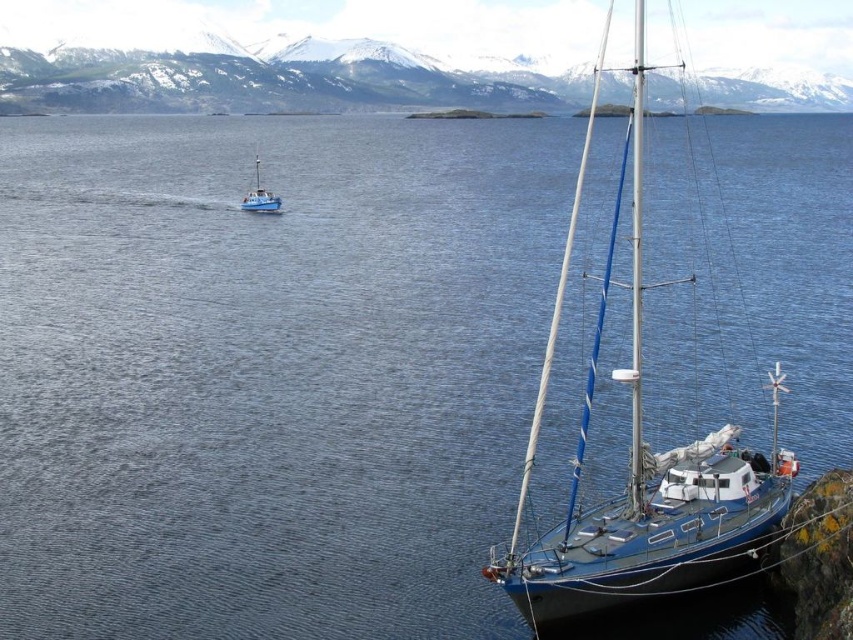
You are a sailor planning to navigate from the metallic blue sailboat at right to the snowy mountain at upper center. Based on the scene, is the mountain visible from the boat?

The snowy mountain at upper center is located above the metallic blue sailboat at right, so yes, the mountain is visible from the boat as it is positioned above it.

You are standing on the rocky shore near the metallic blue sailboat at right and want to take a photo of it. The camera you have can only focus on objects within 30 meters. Will the sailboat be in focus?

The metallic blue sailboat at right is 31.78 meters away from the camera, which is beyond the 30 meter focus range. Therefore, the sailboat will not be in focus.

Consider the image. You are an observer standing on the rocky shore where the metallic blue sailboat at right is moored. You notice the blue matte boat at upper left moving away from you. Based on their sizes, which boat appears taller from your vantage point?

The metallic blue sailboat at right appears taller because it has a greater height compared to the blue matte boat at upper left.